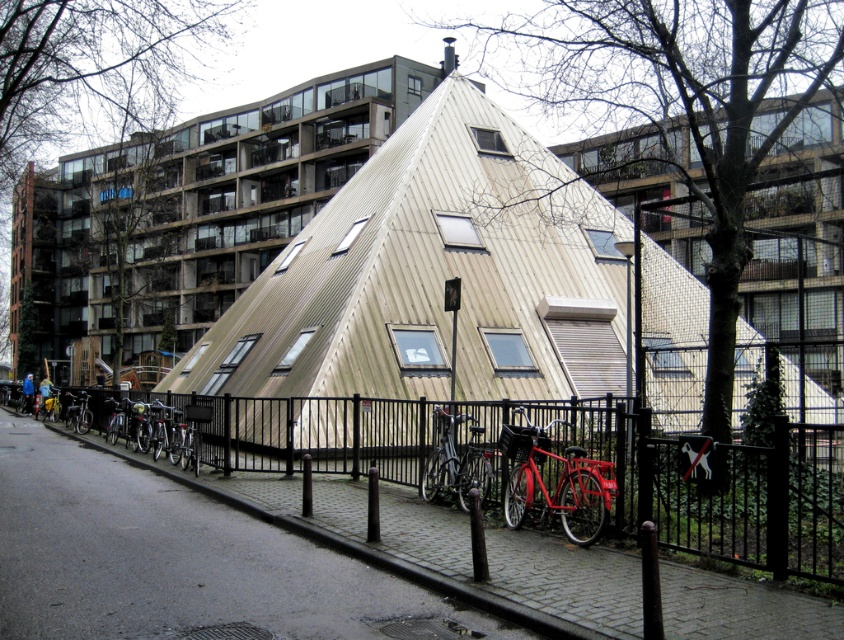
You are a delivery person trying to navigate a narrow alley between the black metal fence at center and the shiny red bicycle at center. The alley is only 1.5 meters wide. Can your delivery cart, which is 1.2 meters wide, safely pass through this space?

The black metal fence at center is wider than the shiny red bicycle at center. Since the alley is 1.5 meters wide and your cart is 1.2 meters wide, there is enough space for the cart to pass safely as long as the fence and bicycle do not protrude into the alley beyond their widths.

You are a delivery person who needs to park your shiny red bicycle at center and black matte bicycle at lower left near the fence. The fence has a width of 1 meter. Can both bicycles fit side by side along the fence without overlapping?

The shiny red bicycle at center is smaller than the black matte bicycle at lower left. Since the fence is 1 meter wide, both bicycles can fit side by side along the fence without overlapping as their combined width is less than 1 meter.

You are a delivery person trying to park your shiny red bicycle at center near the black metal fence at center. Can you park the bicycle so that it is above the fence?

The black metal fence at center is below the shiny red bicycle at center, so yes, you can park the shiny red bicycle at center above the fence.